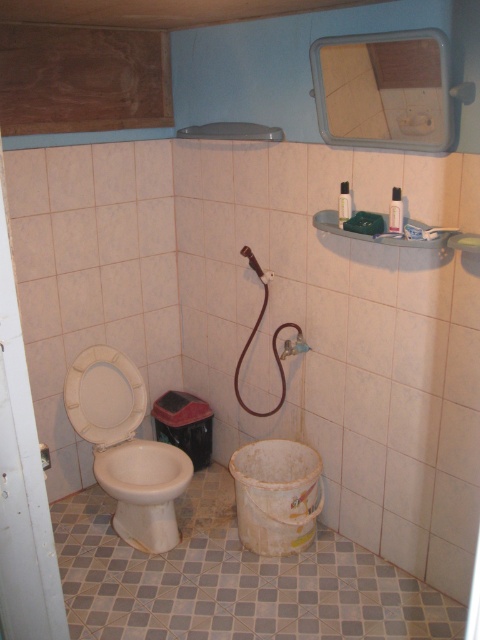
Can you confirm if white glossy toilet at left is positioned to the left of white glossy toilet bowl at lower left?

Correct, you'll find white glossy toilet at left to the left of white glossy toilet bowl at lower left.

Does white glossy toilet at left come in front of white glossy toilet bowl at lower left?

A: No, it is not.

What are the coordinates of `white glossy toilet at left` in the screenshot? It's located at (126, 448).

Identify the location of white glossy toilet bowl at lower left. (144, 490).

Locate an element on the screen. The image size is (480, 640). white glossy toilet bowl at lower left is located at coordinates (144, 490).

This screenshot has width=480, height=640. Describe the element at coordinates (126, 448) in the screenshot. I see `white glossy toilet at left` at that location.

Does white glossy toilet at left have a larger size compared to rubber hose at center?

Yes, white glossy toilet at left is bigger than rubber hose at center.

This screenshot has height=640, width=480. In order to click on white glossy toilet at left in this screenshot , I will do `click(126, 448)`.